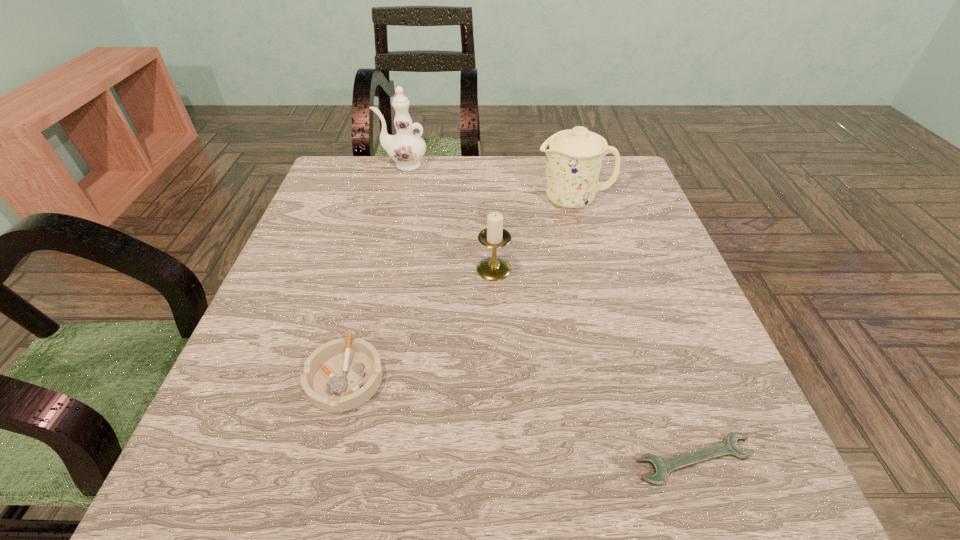
At what (x,y) coordinates should I click in order to perform the action: click on the farther chinaware. Please return your answer as a coordinate pair (x, y). Image resolution: width=960 pixels, height=540 pixels. Looking at the image, I should click on point(406,148).

Locate an element on the screen. the left chinaware is located at coordinates (406, 148).

Where is `the right chinaware`? the right chinaware is located at coordinates (573, 157).

At what (x,y) coordinates should I click in order to perform the action: click on the nearer chinaware. Please return your answer as a coordinate pair (x, y). Image resolution: width=960 pixels, height=540 pixels. Looking at the image, I should click on (573, 157).

Locate an element on the screen. The height and width of the screenshot is (540, 960). the third farthest object is located at coordinates (493, 268).

Locate an element on the screen. The image size is (960, 540). the third tallest object is located at coordinates (493, 268).

This screenshot has height=540, width=960. In order to click on the fourth farthest object in this screenshot , I will do `click(340, 375)`.

I want to click on ashtray, so click(x=340, y=375).

The image size is (960, 540). In order to click on the nearest object in this screenshot , I will do pos(662,467).

You are a GUI agent. You are given a task and a screenshot of the screen. Output one action in this format:
    pyautogui.click(x=<x>, y=<y>)
    Task: Click on the wrench
    This screenshot has width=960, height=540.
    Given the screenshot: What is the action you would take?
    pyautogui.click(x=662, y=467)